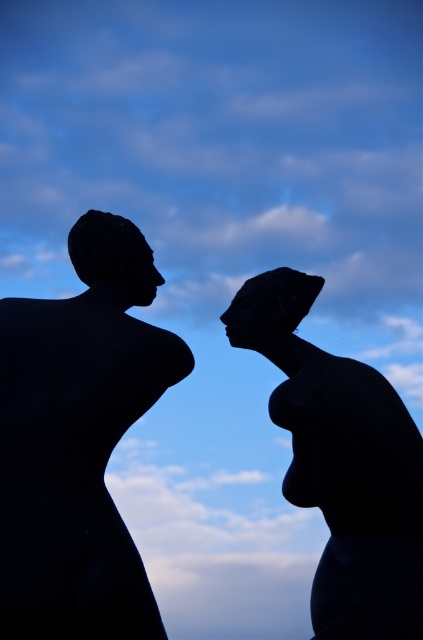
Question: Which of the following is the farthest from the observer?

Choices:
 (A) (301, 356)
 (B) (90, 420)

Answer: (A)

Question: Which of the following is the farthest from the observer?

Choices:
 (A) (91, 604)
 (B) (401, 620)

Answer: (B)

Question: Does black matte sculpture at left appear on the right side of silhouette stone head at center?

Choices:
 (A) yes
 (B) no

Answer: (B)

Question: Is black matte sculpture at center wider than silhouette stone head at center?

Choices:
 (A) no
 (B) yes

Answer: (B)

Question: Where is black matte sculpture at left located in relation to silhouette stone head at center in the image?

Choices:
 (A) above
 (B) below

Answer: (A)

Question: Which object is positioned farthest from the black matte sculpture at left?

Choices:
 (A) black matte sculpture at center
 (B) silhouette stone head at center

Answer: (B)